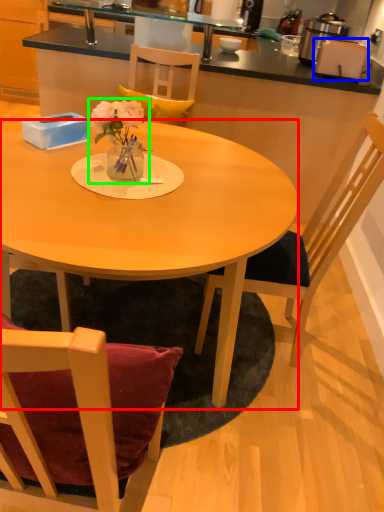
Question: Based on their relative distances, which object is farther from desk (highlighted by a red box)? Choose from toaster (highlighted by a blue box) and floral arrangement (highlighted by a green box).

Choices:
 (A) toaster
 (B) floral arrangement

Answer: (A)